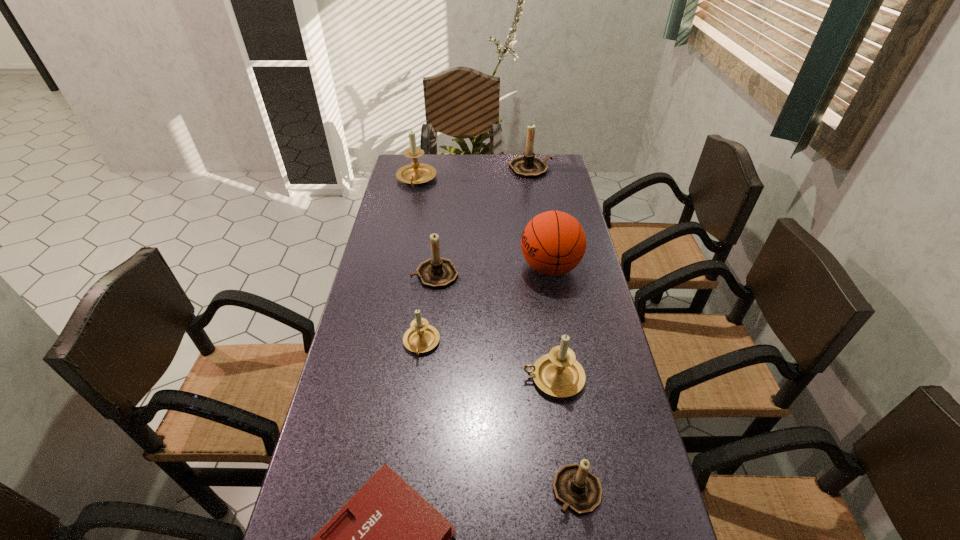
I want to click on free space located 0.060m with a handle on the side of the biggest beige candle holder, so click(412, 201).

Find the location of a particular element. free location located on the side with logo of the basketball is located at coordinates (464, 267).

Identify the location of free location located 0.090m on the side with logo of the basketball. Image resolution: width=960 pixels, height=540 pixels. (492, 267).

Locate an element on the screen. This screenshot has height=540, width=960. vacant region located 0.110m on the side with logo of the basketball is located at coordinates (486, 267).

The height and width of the screenshot is (540, 960). What are the coordinates of `vacant point located on the front of the leftmost brown candle holder` in the screenshot? It's located at (427, 349).

Image resolution: width=960 pixels, height=540 pixels. Identify the location of vacant region located with a handle on the side of the second smallest beige candle holder. (479, 378).

The height and width of the screenshot is (540, 960). I want to click on vacant region located with a handle on the side of the second smallest beige candle holder, so click(x=468, y=378).

Where is `vacant region located with a handle on the side of the second smallest beige candle holder`? Image resolution: width=960 pixels, height=540 pixels. vacant region located with a handle on the side of the second smallest beige candle holder is located at coordinates (444, 378).

Where is `vacant region located with a handle on the side of the smallest beige candle holder`? The height and width of the screenshot is (540, 960). vacant region located with a handle on the side of the smallest beige candle holder is located at coordinates (416, 388).

I want to click on free point located on the back of the nearest brown candle holder, so click(555, 348).